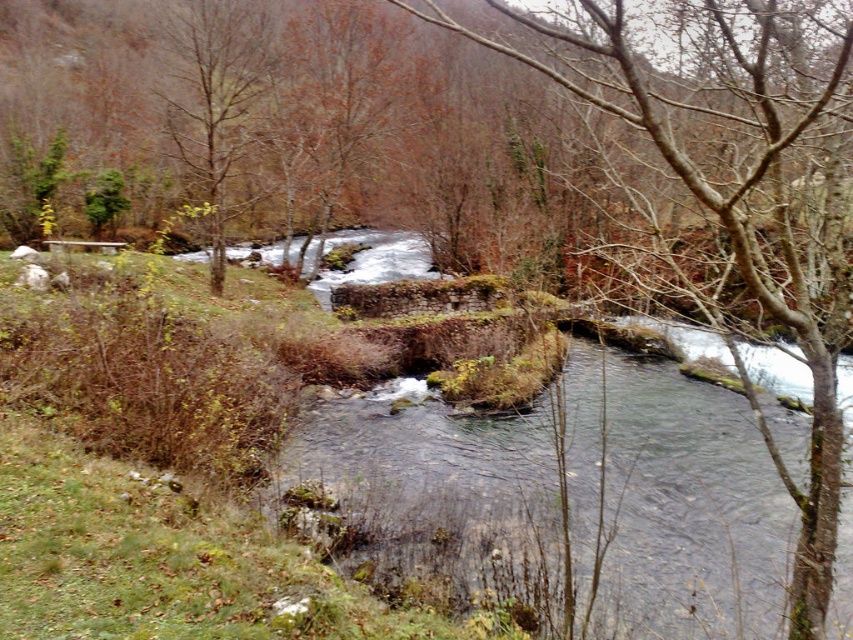
You are a bird flying over the river and want to land on the bare branches at center. Based on the 2D coordinates provided, where exactly should you aim to land?

The bare branches at center are located at the 2D coordinates point (x=735, y=189), so you should aim for that point to land.

You are standing at the point marked as point (334, 104) in the image. What object is exactly at your current location?

The brown leafy tree at upper center is located at point (334, 104).

You are a bird looking for a place to perch. There are two bare branches at center. How far apart are they?

The two bare branches at center are 9.78 feet apart.